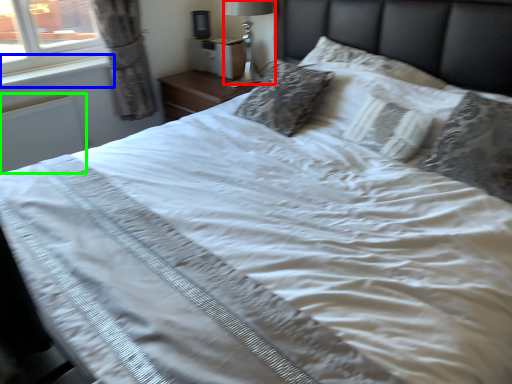
Question: Which object is positioned closest to bedside lamp (highlighted by a red box)? Select from window sill (highlighted by a blue box) and radiator (highlighted by a green box).

Choices:
 (A) window sill
 (B) radiator

Answer: (A)